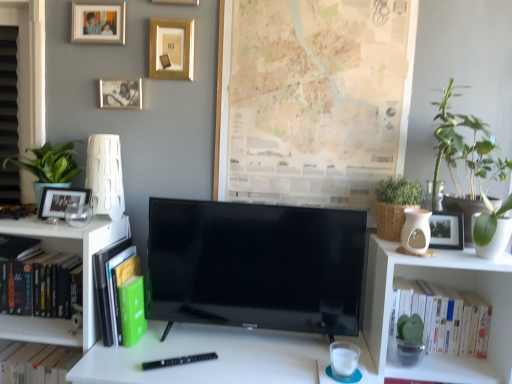
At what (x,y) coordinates should I click in order to perform the action: click on free space in front of green matte book at left, the second book from the right. Please return your answer as a coordinate pair (x, y). Looking at the image, I should click on (116, 365).